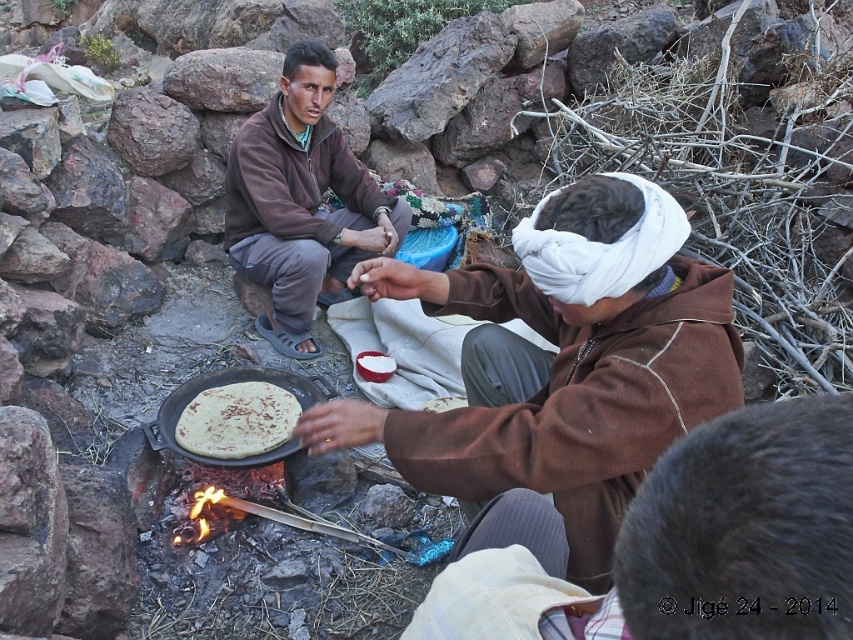
Can you confirm if brown soft cloth at center is wider than brown fleece jacket at center?

Indeed, brown soft cloth at center has a greater width compared to brown fleece jacket at center.

Which is more to the left, brown soft cloth at center or brown fleece jacket at center?

brown fleece jacket at center is more to the left.

Is point (619, 436) positioned after point (245, 182)?

No, (619, 436) is closer to viewer.

Where is `brown soft cloth at center`? The height and width of the screenshot is (640, 853). brown soft cloth at center is located at coordinates (561, 362).

Between brown fleece jacket at center and brown matte flatbread at center, which one has less height?

With less height is brown matte flatbread at center.

Can you confirm if brown fleece jacket at center is wider than brown matte flatbread at center?

Yes, brown fleece jacket at center is wider than brown matte flatbread at center.

Between point (315, 234) and point (225, 429), which one is positioned behind?

The point (315, 234) is behind.

Identify the location of brown fleece jacket at center. (302, 202).

Is brown soft cloth at center wider than brown matte flatbread at center?

Yes, brown soft cloth at center is wider than brown matte flatbread at center.

Locate an element on the screen. The height and width of the screenshot is (640, 853). brown soft cloth at center is located at coordinates (561, 362).

Where is `brown soft cloth at center`? This screenshot has height=640, width=853. brown soft cloth at center is located at coordinates coord(561,362).